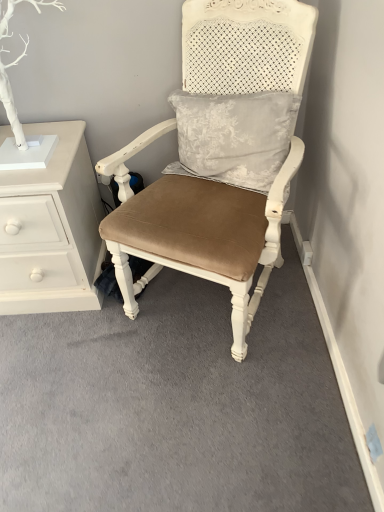
At what (x,y) coordinates should I click in order to perform the action: click on vacant position to the left of suede-like tan cushion at center. Please return your answer as a coordinate pair (x, y). The height and width of the screenshot is (512, 384). Looking at the image, I should click on (71, 356).